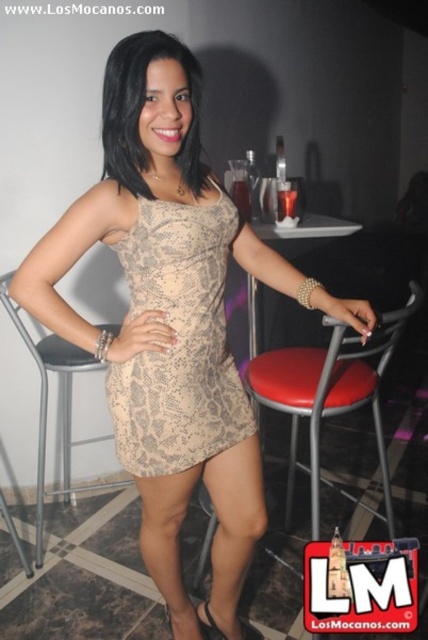
You are a photographer setting up a shoot in a bar. You have a snake skin beige dress at center and a red leather stool at center. You need to adjust the camera angle so that the dress is fully visible without being blocked by the stool. Is this possible given their sizes?

The snake skin beige dress at center is shorter than the red leather stool at center, so adjusting the camera angle to ensure the dress is fully visible without obstruction may be challenging since the stool is taller. Consider lowering the camera angle or moving the stool slightly to allow the dress to be seen clearly.

You are a photographer setting up a shoot in a bar. You need to ensure that the snake skin beige dress at center is visible above the black leather stool at center in your photo. Based on their heights, is this possible?

The snake skin beige dress at center is not as tall as the black leather stool at center, so it will not be visible above the stool in the photo.

You are a photographer setting up for a shoot in this bar setting. You need to ensure that the snake skin beige dress at center and the black leather stool at center are both visible in the frame. Based on their positions, which object will appear larger in the photo?

The snake skin beige dress at center will appear larger in the photo because it is closer to the viewer than the black leather stool at center.